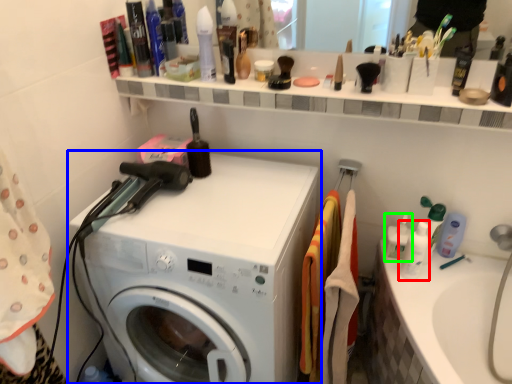
Question: Which object is the closest to the toiletry (highlighted by a red box)? Choose among these: washing machine (highlighted by a blue box) or cleaning product (highlighted by a green box).

Choices:
 (A) washing machine
 (B) cleaning product

Answer: (B)